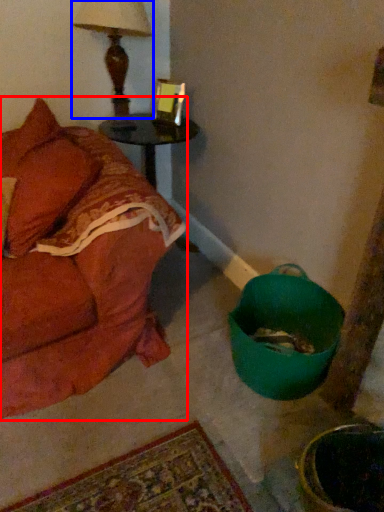
Question: Which point is closer to the camera, studio couch (highlighted by a red box) or table lamp (highlighted by a blue box)?

Choices:
 (A) studio couch
 (B) table lamp

Answer: (A)